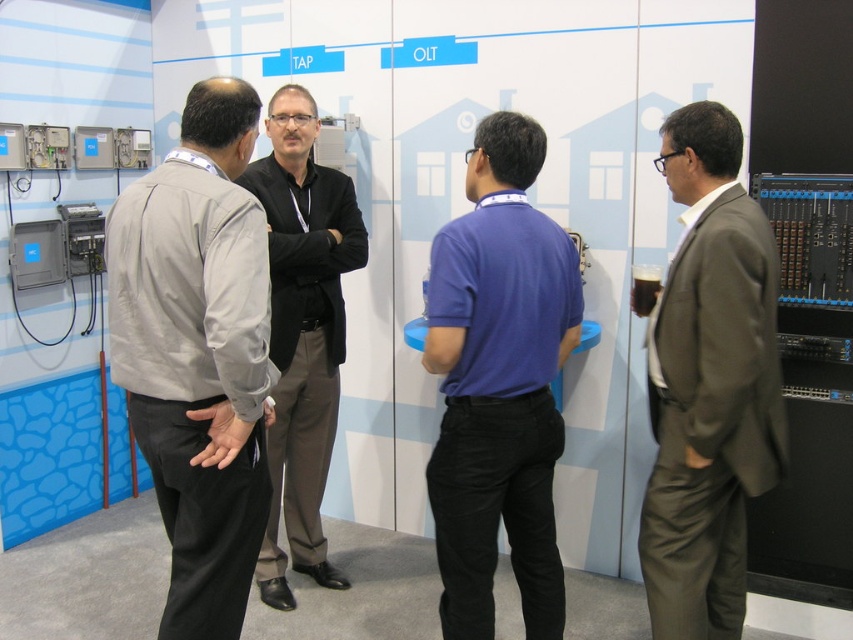
You are an event planner arranging seating for a panel discussion. You need to seat the person in the light gray fabric jacket at left and the person in the black smooth shirt at center based on their height. Which person should you seat in the first row to ensure visibility?

The light gray fabric jacket at left is not as tall as the black smooth shirt at center, so seating the light gray fabric jacket at left in the first row would ensure better visibility for both individuals.

You are a photographer at a trade show who needs to capture a group photo of the purple cotton polo shirt at center and the black smooth shirt at center. The camera you are using has a minimum focusing distance of 36 inches. Will you be able to take a clear photo of both subjects without moving the camera?

The purple cotton polo shirt at center is 36.42 inches away from the black smooth shirt at center. Since the camera has a minimum focusing distance of 36 inches, the distance between them is sufficient, so yes, you can take a clear photo of both subjects without moving the camera.

You are standing in the professional setting shown in the image. You need to locate the light gray fabric jacket at left. Where would you look?

The light gray fabric jacket at left is located at the 2D coordinates point (198, 353).